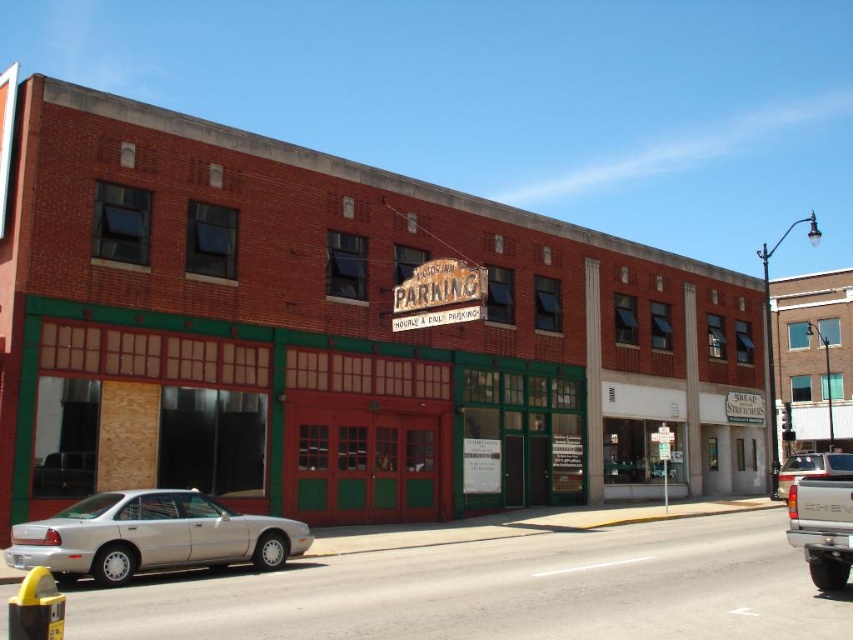
Question: Does silver metallic truck at lower right have a greater width compared to white matte truck at lower right?

Choices:
 (A) no
 (B) yes

Answer: (A)

Question: Which point appears farthest from the camera in this image?

Choices:
 (A) (849, 509)
 (B) (68, 577)

Answer: (B)

Question: Which of these objects is positioned farthest from the silver metallic sedan at lower left?

Choices:
 (A) silver metallic truck at lower right
 (B) white matte truck at lower right

Answer: (B)

Question: Can you confirm if silver metallic sedan at lower left is positioned below silver metallic truck at lower right?

Choices:
 (A) yes
 (B) no

Answer: (B)

Question: Does silver metallic sedan at lower left lie behind silver metallic truck at lower right?

Choices:
 (A) no
 (B) yes

Answer: (B)

Question: Which point is farther to the camera?

Choices:
 (A) (77, 502)
 (B) (796, 464)

Answer: (B)